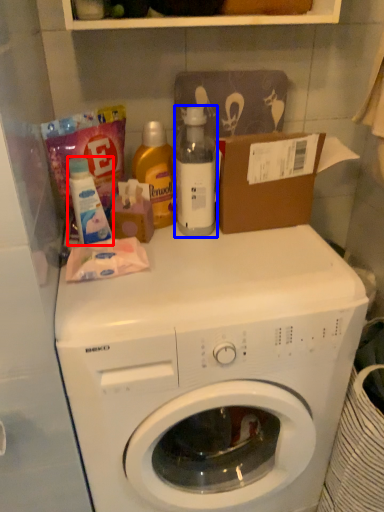
Question: Among these objects, which one is nearest to the camera, cleaning product (highlighted by a red box) or bottle (highlighted by a blue box)?

Choices:
 (A) cleaning product
 (B) bottle

Answer: (A)